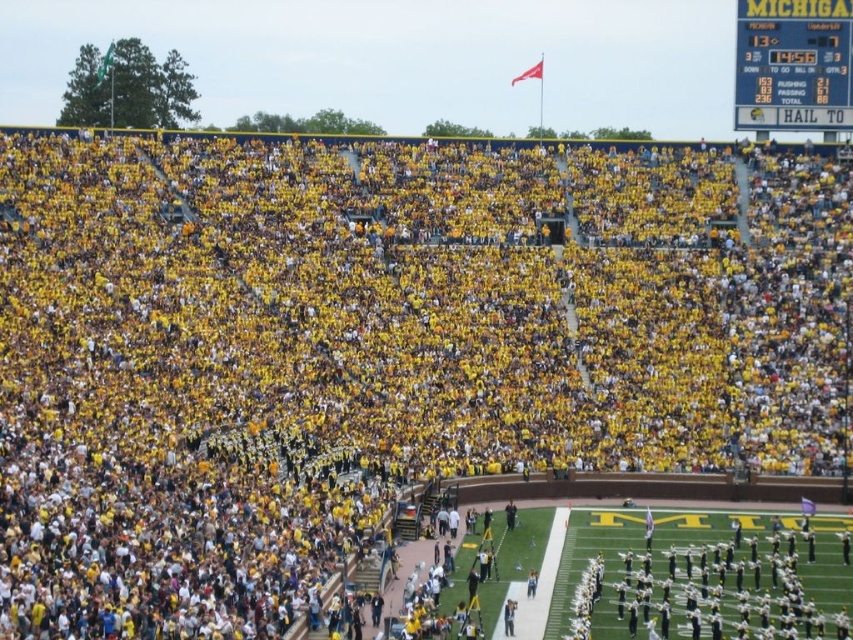
Question: Does white uniformed band at lower right appear on the left side of yellow plastic scoreboard at upper right?

Choices:
 (A) no
 (B) yes

Answer: (B)

Question: Which of the following is the farthest from the observer?

Choices:
 (A) white uniformed band at lower right
 (B) yellow plastic scoreboard at upper right

Answer: (B)

Question: Is white uniformed band at lower right positioned at the back of yellow plastic scoreboard at upper right?

Choices:
 (A) no
 (B) yes

Answer: (A)

Question: Which point is closer to the camera taking this photo?

Choices:
 (A) (755, 620)
 (B) (795, 90)

Answer: (A)

Question: Does white uniformed band at lower right appear under yellow plastic scoreboard at upper right?

Choices:
 (A) no
 (B) yes

Answer: (B)